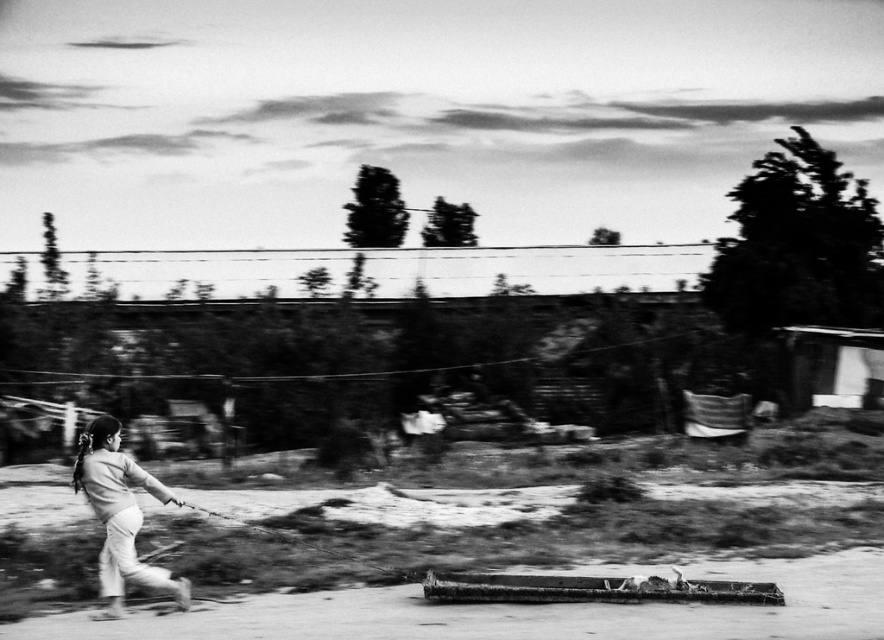
Who is positioned more to the right, smooth dirt track at lower center or smooth skin girl at lower left?

smooth dirt track at lower center

Is point (635, 618) positioned before point (187, 579)?

Yes.

Where is `smooth dirt track at lower center`? The image size is (884, 640). smooth dirt track at lower center is located at coordinates (520, 611).